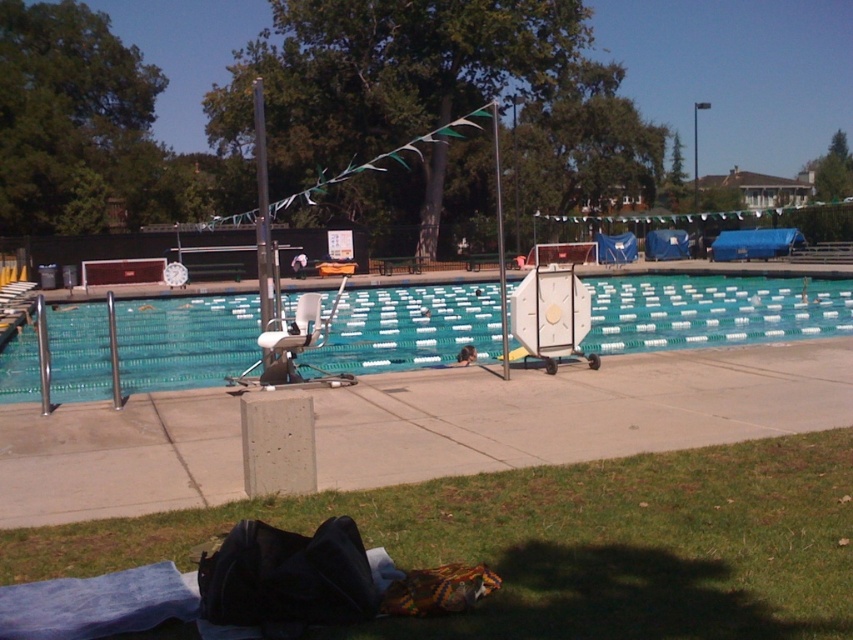
Question: Among these points, which one is farthest from the camera?

Choices:
 (A) (498, 170)
 (B) (263, 221)

Answer: (A)

Question: Which point is farther to the camera?

Choices:
 (A) silver metallic pole at center
 (B) teal plastic pool at center
 (C) green grass at lower center
 (D) metallic pole at center

Answer: (B)

Question: Where is green grass at lower center located in relation to silver metallic pole at center in the image?

Choices:
 (A) left
 (B) right

Answer: (B)

Question: Is teal plastic pool at center below metallic pole at center?

Choices:
 (A) yes
 (B) no

Answer: (A)

Question: Is green grass at lower center in front of metallic pole at center?

Choices:
 (A) no
 (B) yes

Answer: (B)

Question: Which object is positioned closest to the silver metallic pole at center?

Choices:
 (A) green grass at lower center
 (B) metallic pole at center

Answer: (A)